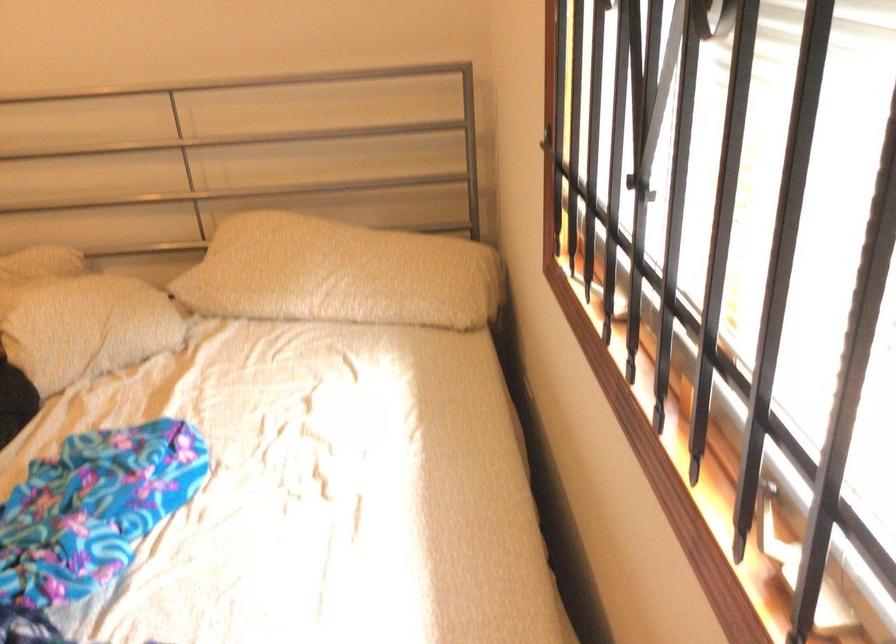
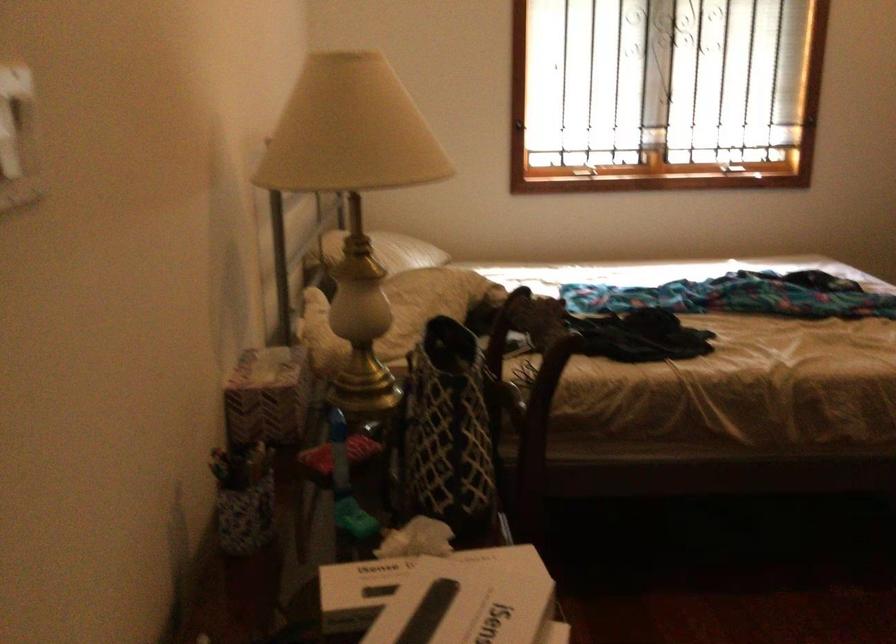
In the second image, find the point that corresponds to (526,149) in the first image.

(520, 124)